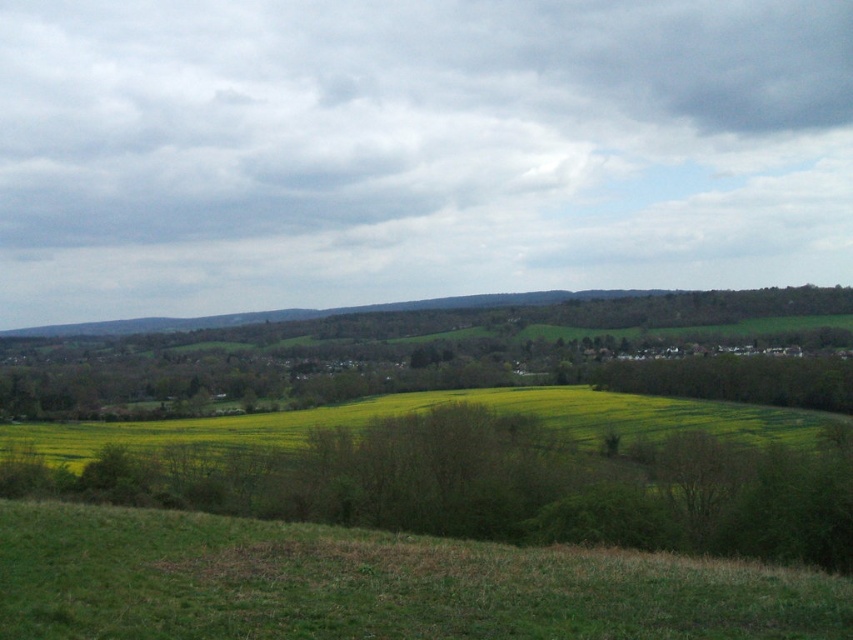
Question: Does green grassy hill at lower center have a smaller size compared to yellow-green grass at center?

Choices:
 (A) yes
 (B) no

Answer: (A)

Question: Is green grassy hill at lower center to the right of yellow-green grass at center from the viewer's perspective?

Choices:
 (A) no
 (B) yes

Answer: (B)

Question: Can you confirm if green grassy hill at lower center is smaller than yellow-green grass at center?

Choices:
 (A) no
 (B) yes

Answer: (B)

Question: Among these points, which one is farthest from the camera?

Choices:
 (A) (697, 420)
 (B) (422, 557)

Answer: (A)